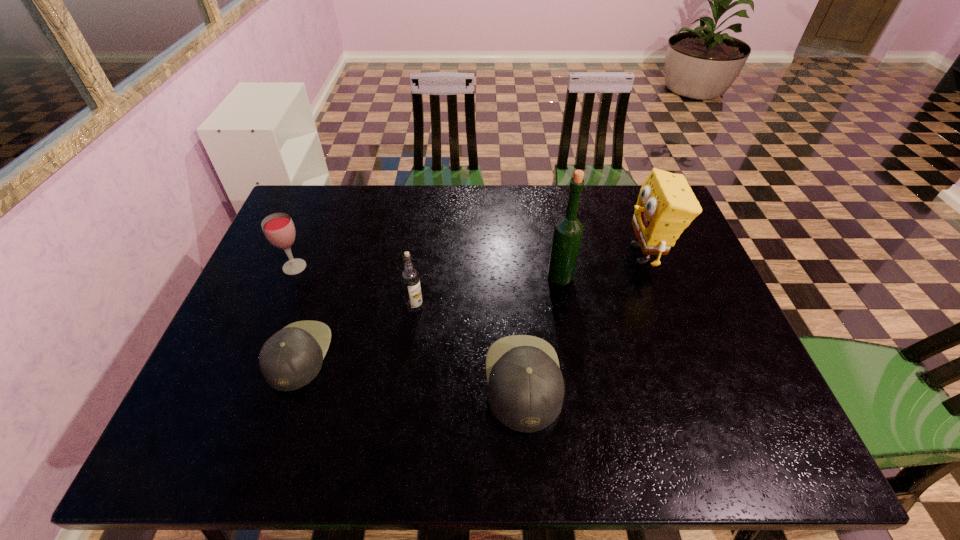
The image size is (960, 540). What are the coordinates of `wineglass positioned at the left edge` in the screenshot? It's located at (278, 228).

Where is `object that is at the right edge`? object that is at the right edge is located at coordinates tap(666, 205).

I want to click on object situated at the near left corner, so click(290, 359).

The width and height of the screenshot is (960, 540). Find the location of `vacant space at the far edge`. vacant space at the far edge is located at coordinates (468, 185).

I want to click on vacant area at the left edge, so click(x=279, y=305).

At what (x,y) coordinates should I click in order to perform the action: click on vacant space at the right edge of the desktop. Please return your answer as a coordinate pair (x, y). The height and width of the screenshot is (540, 960). Looking at the image, I should click on (680, 265).

Locate an element on the screen. This screenshot has height=540, width=960. vacant region at the far left corner of the desktop is located at coordinates (299, 220).

This screenshot has height=540, width=960. Find the location of `blank space at the near left corner of the desktop`. blank space at the near left corner of the desktop is located at coordinates (196, 405).

You are a GUI agent. You are given a task and a screenshot of the screen. Output one action in this format:
    pyautogui.click(x=<x>, y=<y>)
    Task: Click on the vacant space at the near right corner of the desktop
    The height and width of the screenshot is (540, 960).
    Given the screenshot: What is the action you would take?
    pyautogui.click(x=688, y=383)

Image resolution: width=960 pixels, height=540 pixels. What are the coordinates of `empty space that is in between the left cap and the vodka` in the screenshot? It's located at (357, 331).